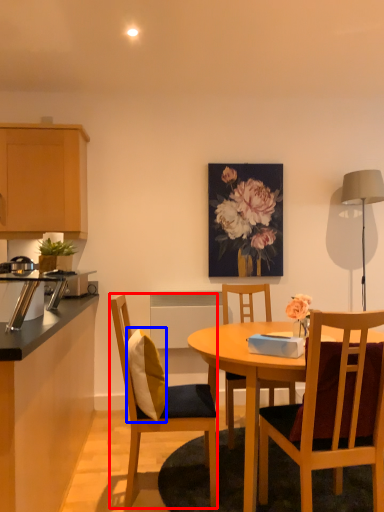
Question: Which of the following is the farthest to the observer, chair (highlighted by a red box) or pillow (highlighted by a blue box)?

Choices:
 (A) chair
 (B) pillow

Answer: (A)